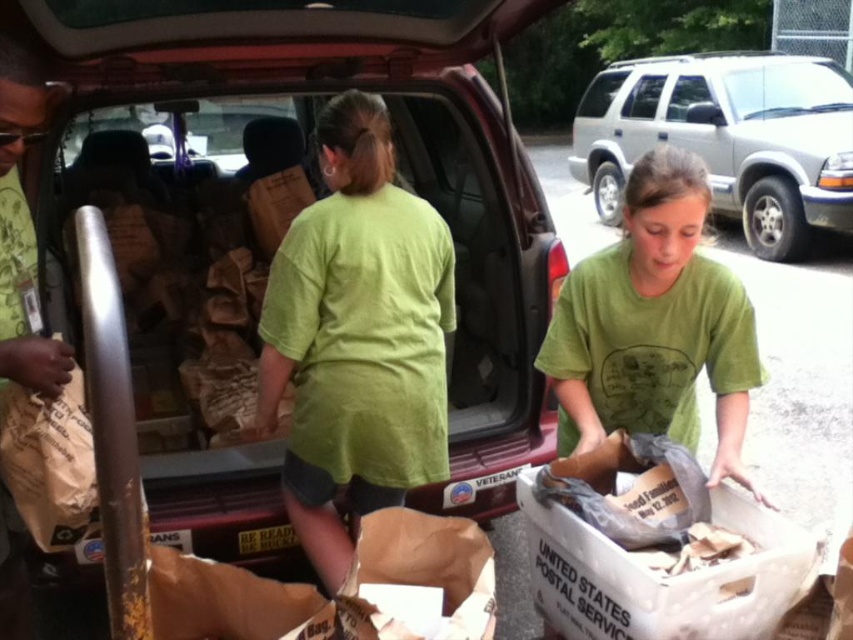
Question: Estimate the real-world distances between objects in this image. Which object is closer to the green cotton shirt at center?

Choices:
 (A) green matte shirt at center
 (B) silver metallic minivan at upper right

Answer: (A)

Question: Is matte brown paper bag at center behind green cotton shirt at center?

Choices:
 (A) yes
 (B) no

Answer: (B)

Question: Which point is closer to the camera?

Choices:
 (A) (213, 532)
 (B) (279, 358)
 (C) (619, 417)

Answer: (C)

Question: Is matte brown paper bag at center thinner than green matte shirt at center?

Choices:
 (A) no
 (B) yes

Answer: (A)

Question: Which of the following is the farthest from the observer?

Choices:
 (A) green matte shirt at center
 (B) matte brown paper bag at center
 (C) green cotton shirt at center
 (D) silver metallic minivan at upper right

Answer: (D)

Question: Is matte brown paper bag at center above silver metallic minivan at upper right?

Choices:
 (A) yes
 (B) no

Answer: (B)